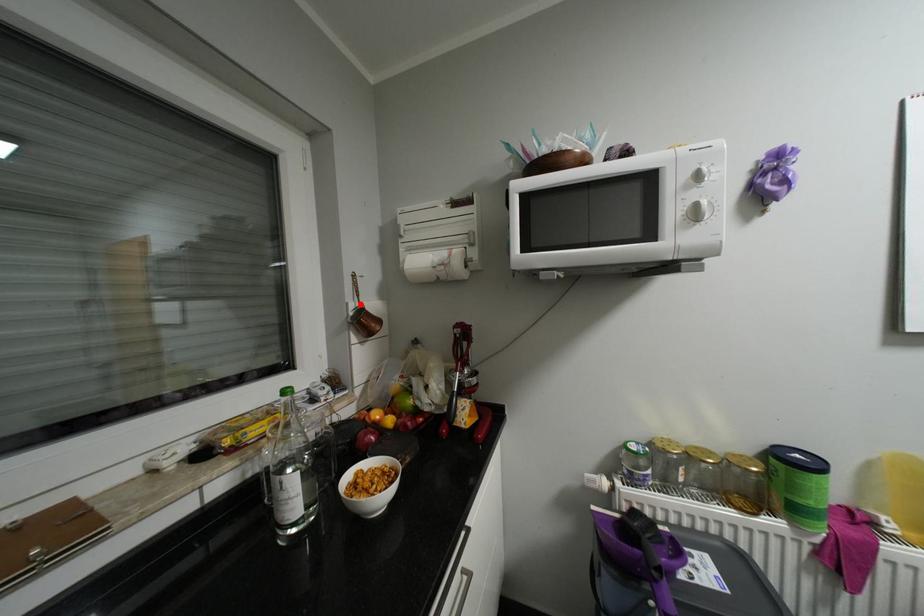
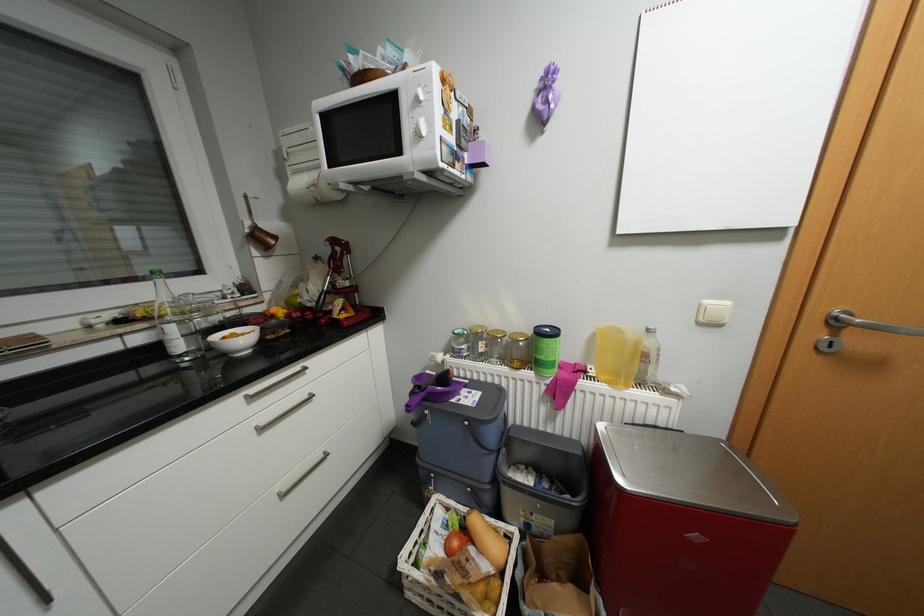
In the second image, find the point that corresponds to the highlighted location in the first image.

(256, 223)